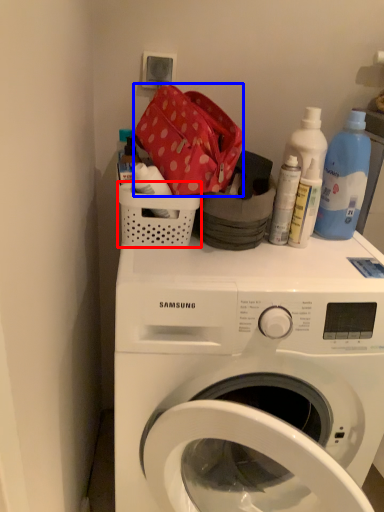
Question: Which point is further to the camera, basket (highlighted by a red box) or material (highlighted by a blue box)?

Choices:
 (A) basket
 (B) material

Answer: (A)